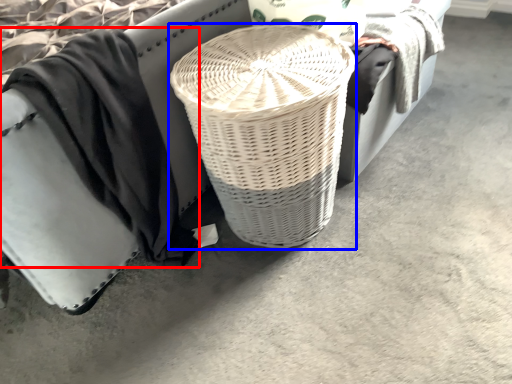
Question: Which point is further to the camera, clothing (highlighted by a red box) or basket (highlighted by a blue box)?

Choices:
 (A) clothing
 (B) basket

Answer: (B)